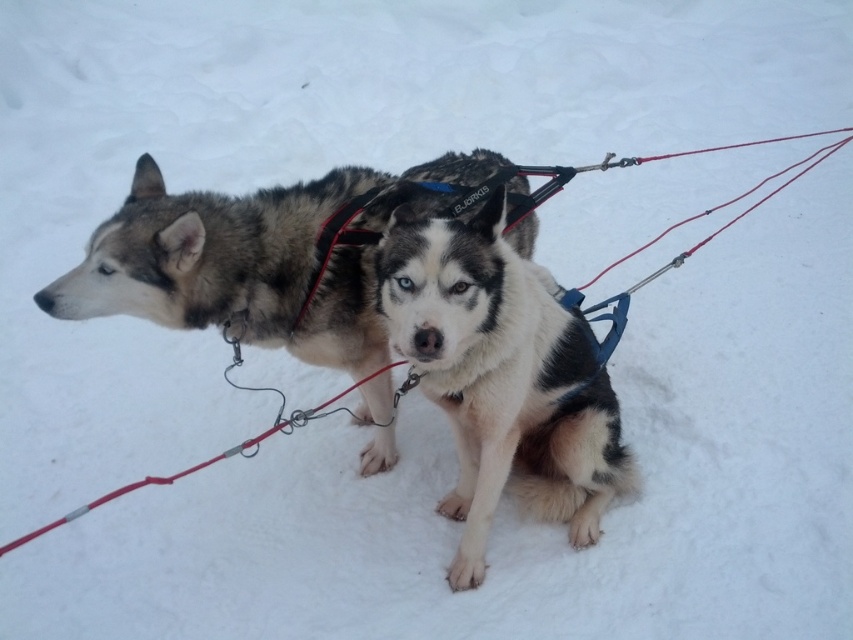
What do you see at coordinates (502, 376) in the screenshot? I see `white fur dog at center` at bounding box center [502, 376].

From the picture: Which is above, white fur dog at center or fluffy fur husky at center?

fluffy fur husky at center is above.

Measure the distance between white fur dog at center and camera.

white fur dog at center is 6.91 feet from camera.

Identify the location of white fur dog at center. Image resolution: width=853 pixels, height=640 pixels. (502, 376).